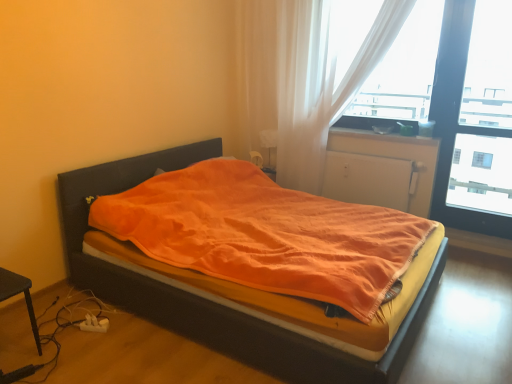
Question: From a real-world perspective, is white matte radiator at center positioned above or below orange fabric bed at center?

Choices:
 (A) above
 (B) below

Answer: (A)

Question: Is white matte radiator at center spatially inside orange fabric bed at center, or outside of it?

Choices:
 (A) inside
 (B) outside

Answer: (B)

Question: Considering the real-world distances, which object is closest to the white matte radiator at center?

Choices:
 (A) translucent white curtain at upper right, placed as the 1th curtain when sorted from left to right
 (B) white plastic charger at lower left
 (C) orange fabric bed at center
 (D) transparent glass window at upper right
 (E) matte plastic window sill at upper right

Answer: (E)

Question: Which of these objects is positioned closest to the transparent glass window at upper right?

Choices:
 (A) matte plastic window sill at upper right
 (B) white matte radiator at center
 (C) orange fabric bed at center
 (D) white plastic charger at lower left
 (E) white sheer curtain at upper right, the 2th curtain from the left

Answer: (B)